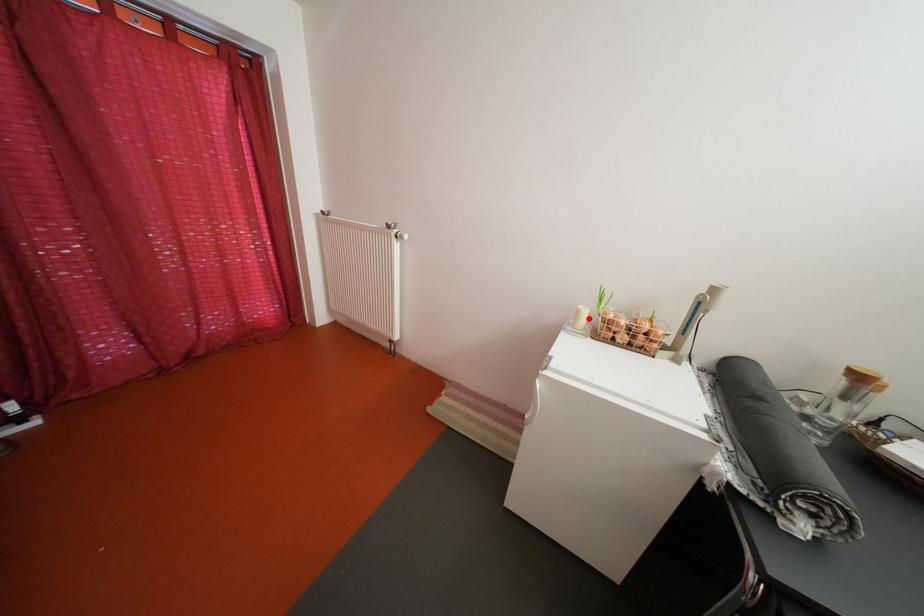
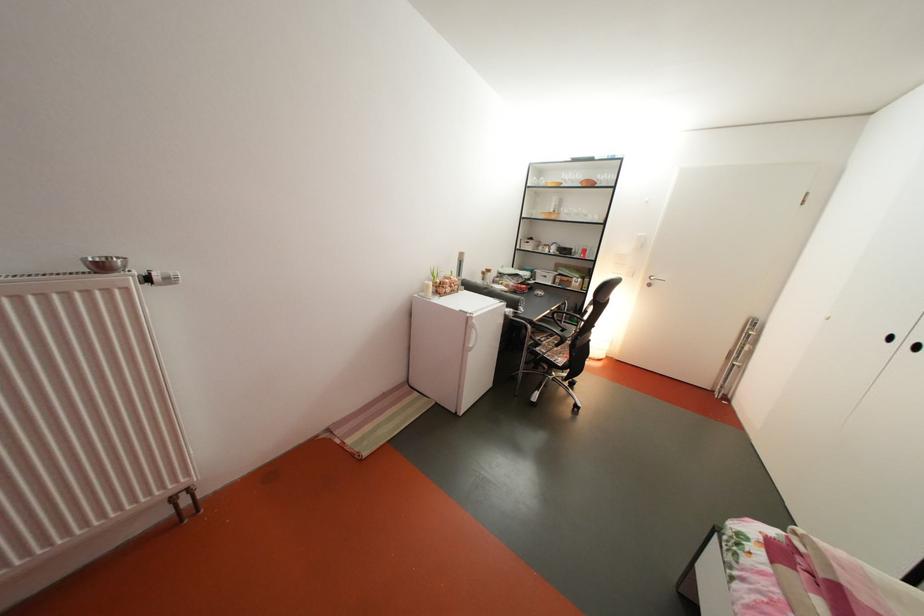
Where in the second image is the point corresponding to the highlighted location from the first image?

(439, 293)